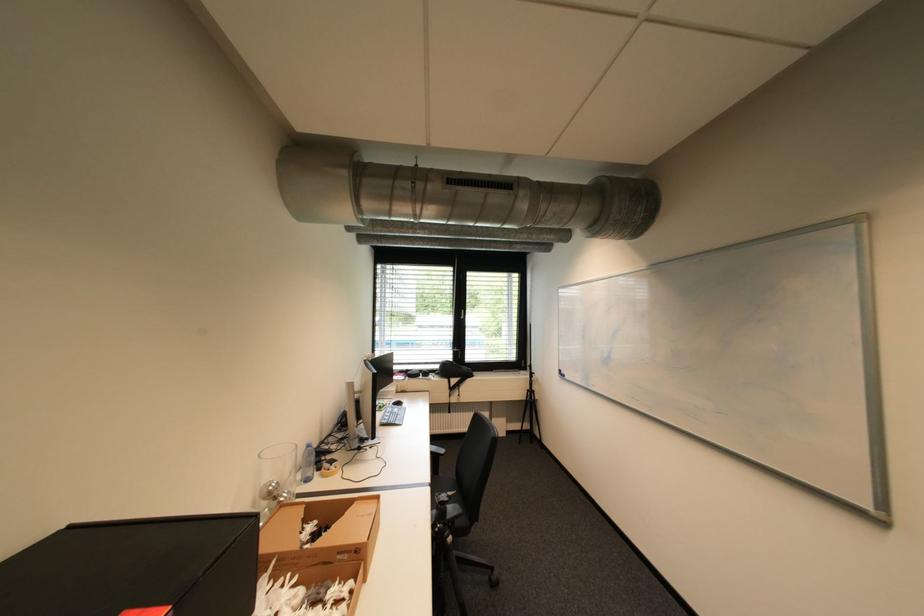
What do you see at coordinates (488, 517) in the screenshot?
I see `the chair sitting surface` at bounding box center [488, 517].